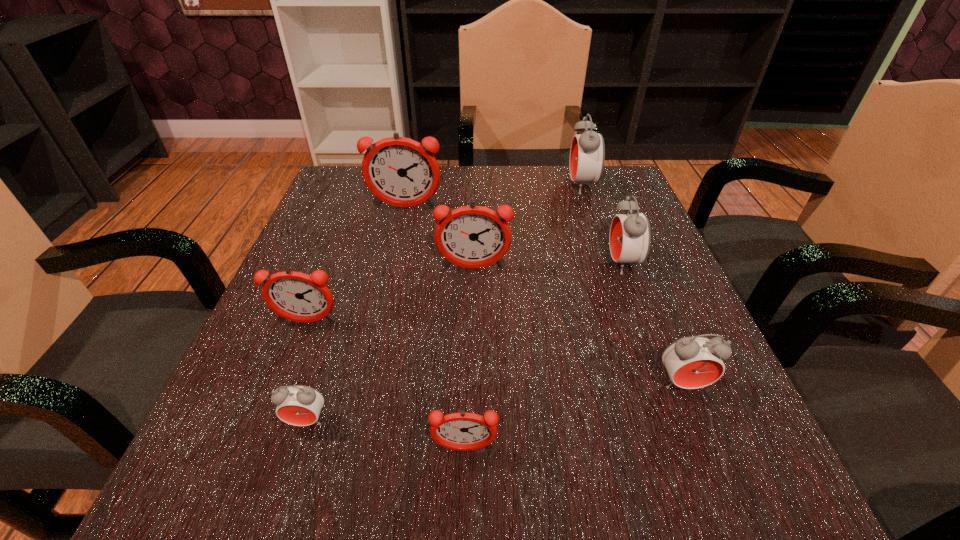
The width and height of the screenshot is (960, 540). In order to click on the farthest object in this screenshot , I will do `click(587, 154)`.

Where is `the farthest red alarm clock`? This screenshot has height=540, width=960. the farthest red alarm clock is located at coordinates (587, 154).

The height and width of the screenshot is (540, 960). Find the location of `the second farthest alarm clock`. the second farthest alarm clock is located at coordinates (400, 171).

Where is `the biggest reddish-pink alarm clock`? the biggest reddish-pink alarm clock is located at coordinates tap(400, 171).

Where is `the third nearest red alarm clock`? the third nearest red alarm clock is located at coordinates (630, 236).

The height and width of the screenshot is (540, 960). Identify the location of the third smallest reddish-pink alarm clock. (472, 236).

Identify the location of the third farthest reddish-pink alarm clock. (296, 296).

This screenshot has width=960, height=540. Find the location of `the fifth farthest alarm clock`. the fifth farthest alarm clock is located at coordinates (296, 296).

Identify the location of the third farthest red alarm clock. The image size is (960, 540). (693, 362).

Find the location of `the sixth farthest alarm clock`. the sixth farthest alarm clock is located at coordinates (693, 362).